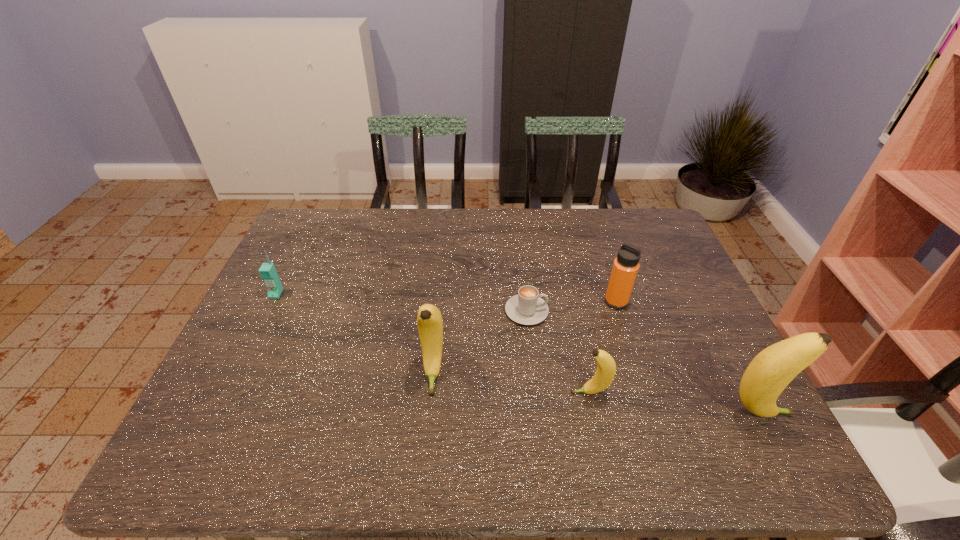
Where is `the fifth object from right to left`? The height and width of the screenshot is (540, 960). the fifth object from right to left is located at coordinates (429, 320).

Where is `the leftmost banana`? The width and height of the screenshot is (960, 540). the leftmost banana is located at coordinates (429, 320).

At what (x,y) coordinates should I click in order to perform the action: click on the second banana from right to left. Please return your answer as a coordinate pair (x, y). Image resolution: width=960 pixels, height=540 pixels. Looking at the image, I should click on (606, 367).

I want to click on the shortest banana, so click(606, 367).

Identify the location of the nearest banana. This screenshot has width=960, height=540. (769, 373).

Identify the location of the rightmost object. The height and width of the screenshot is (540, 960). (769, 373).

Find the location of a particular element. cellular telephone is located at coordinates (268, 273).

Identify the location of the second object from right to left. (626, 265).

Where is `the shortest object`? Image resolution: width=960 pixels, height=540 pixels. the shortest object is located at coordinates (527, 308).

The height and width of the screenshot is (540, 960). Identify the location of the third object from left to right. (527, 308).